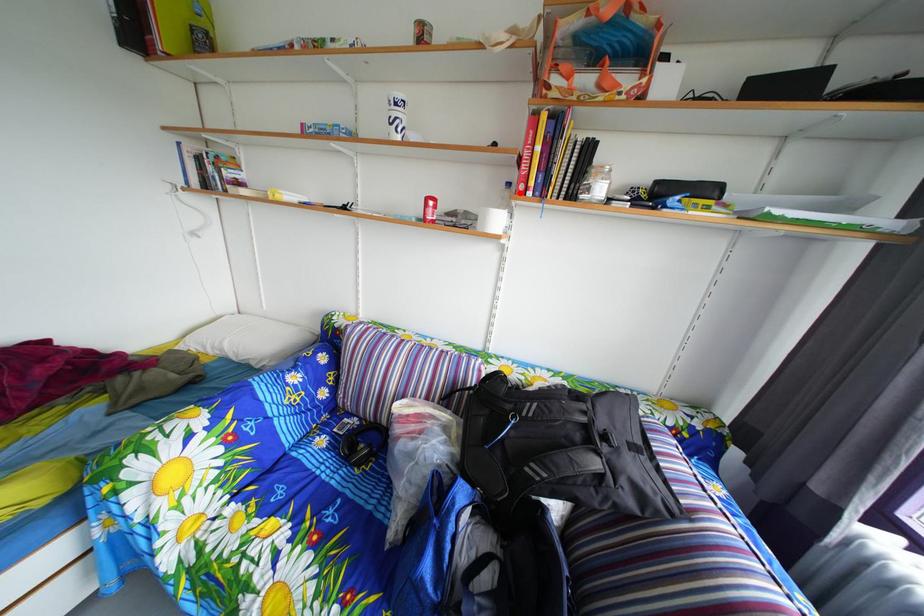
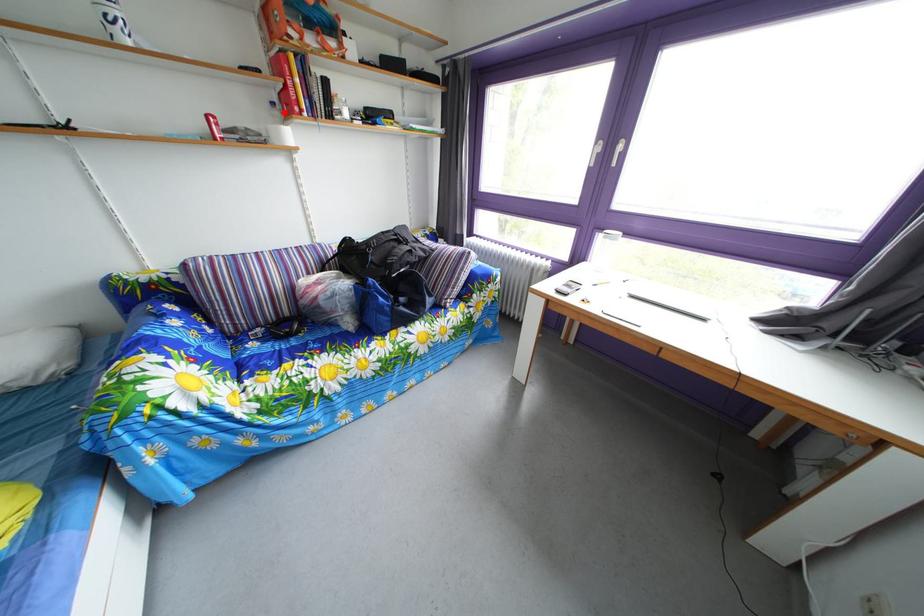
I am providing you with two images of the same scene from different viewpoints. A red point is marked on the first image and another point is marked on the second image. Does the point marked in image1 correspond to the same location as the one in image2?

Yes